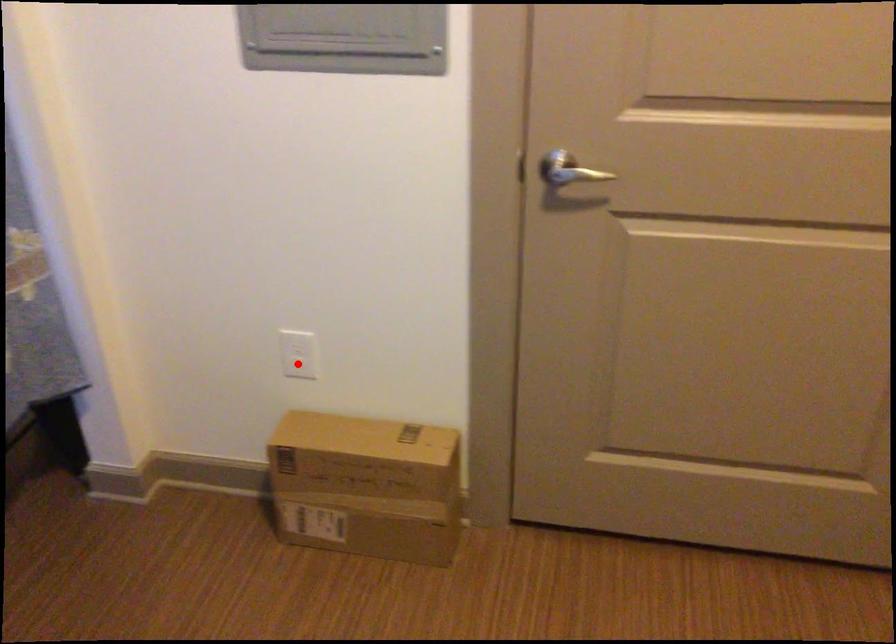
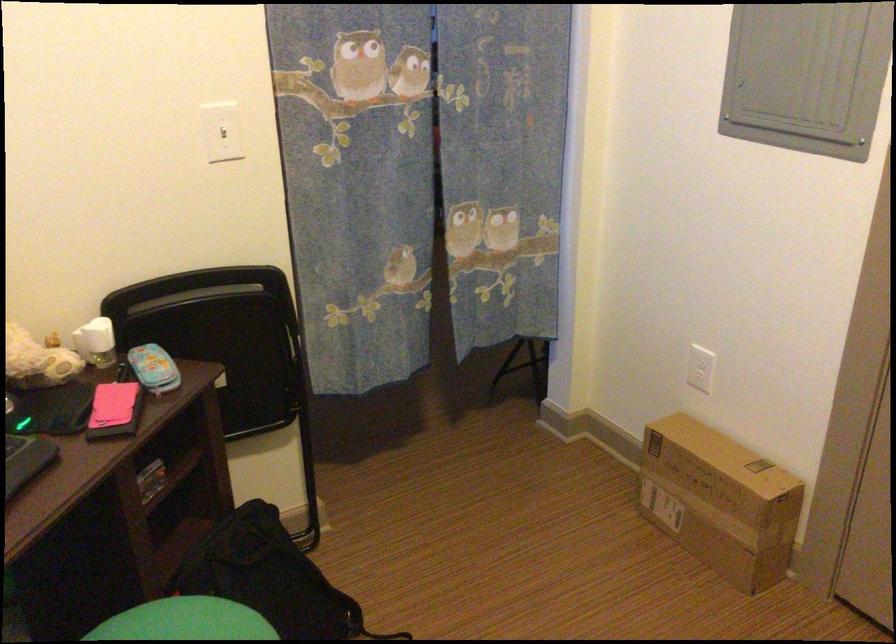
Find the pixel in the second image that matches the highlighted location in the first image.

(700, 368)